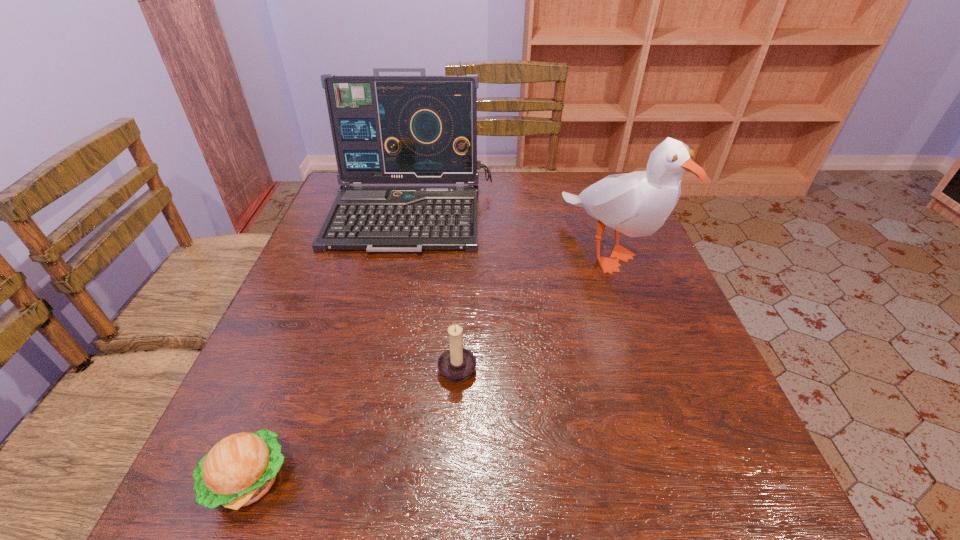
The width and height of the screenshot is (960, 540). I want to click on vacant area at the near edge, so click(x=349, y=496).

The height and width of the screenshot is (540, 960). Find the location of `vacant space at the left edge`. vacant space at the left edge is located at coordinates (297, 448).

At what (x,y) coordinates should I click in order to perform the action: click on vacant region at the right edge of the desktop. Please return your answer as a coordinate pair (x, y). Looking at the image, I should click on (620, 333).

Locate an element on the screen. vacant point located between the laptop computer and the gull is located at coordinates (510, 232).

Image resolution: width=960 pixels, height=540 pixels. In order to click on free space that is in between the rightmost object and the shortest object in this screenshot , I will do `click(428, 366)`.

In order to click on vacant area that lies between the nearest object and the rightmost object in this screenshot , I will do `click(428, 366)`.

I want to click on empty location between the gull and the third farthest object, so click(x=533, y=308).

You are a GUI agent. You are given a task and a screenshot of the screen. Output one action in this format:
    pyautogui.click(x=<x>, y=<y>)
    Task: Click on the vacant area that lies between the shortest object and the third farthest object
    
    Given the screenshot: What is the action you would take?
    pyautogui.click(x=353, y=423)

In order to click on free space that is in between the gull and the nearest object in this screenshot , I will do `click(428, 366)`.

Identify the location of vacant area that lies between the candle holder and the rightmost object. (533, 308).